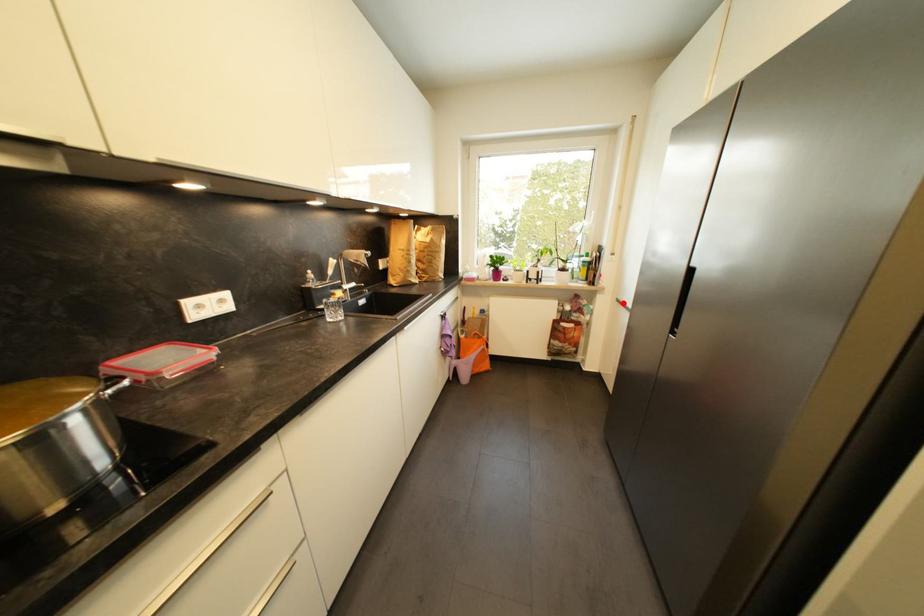
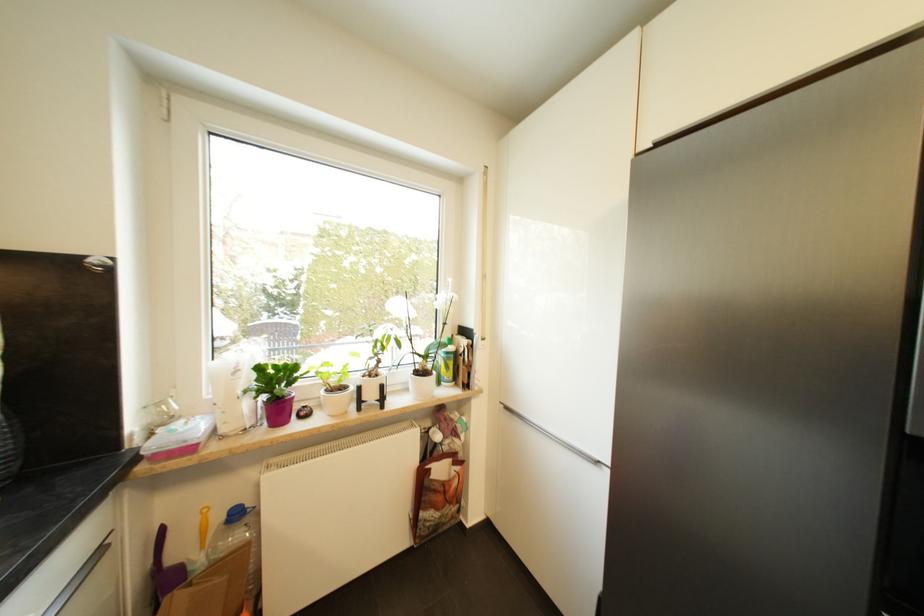
Where in the second image is the point corresponding to the highlighted location from the first image?

(512, 410)